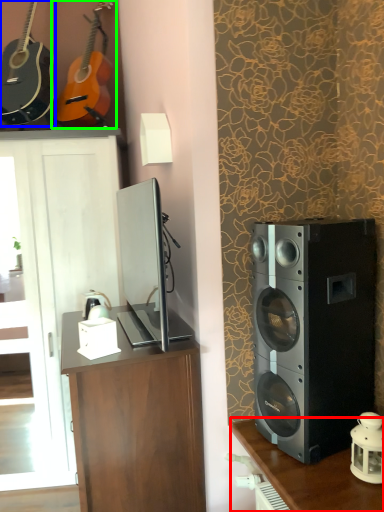
Question: Which is nearer to the table (highlighted by a red box)? guitar (highlighted by a blue box) or guitar (highlighted by a green box).

Choices:
 (A) guitar
 (B) guitar

Answer: (B)